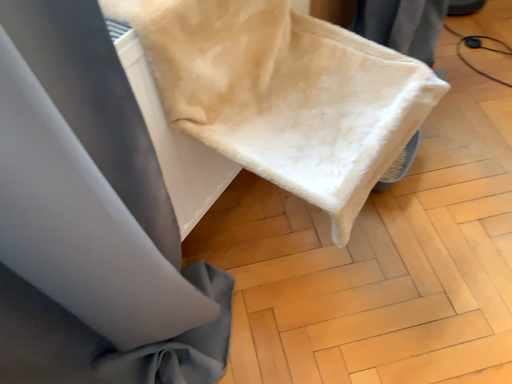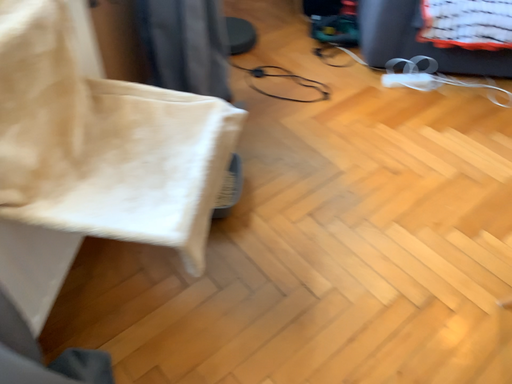
Question: Which way did the camera rotate in the video?

Choices:
 (A) rotated upward
 (B) rotated downward

Answer: (A)